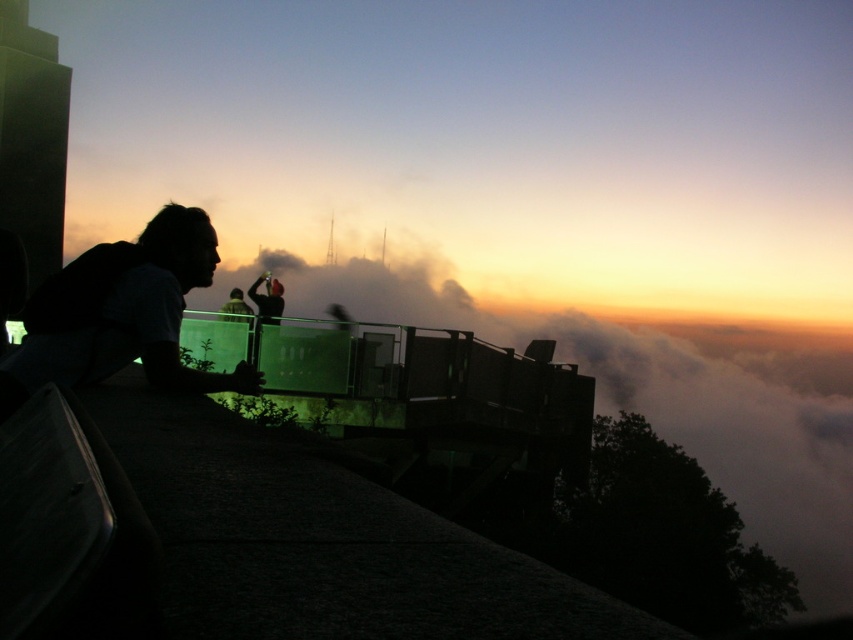
Question: Does dark hair at left have a greater width compared to dark fabric jacket at center?

Choices:
 (A) no
 (B) yes

Answer: (A)

Question: Does dark hair at left appear under dark fabric jacket at center?

Choices:
 (A) no
 (B) yes

Answer: (B)

Question: Which object appears closest to the camera in this image?

Choices:
 (A) dark hair at left
 (B) dark fabric jacket at center

Answer: (A)

Question: Which of the following is the farthest from the observer?

Choices:
 (A) pos(201,248)
 (B) pos(268,276)

Answer: (B)

Question: Can you confirm if dark hair at left is thinner than dark fabric jacket at center?

Choices:
 (A) no
 (B) yes

Answer: (B)

Question: Among these points, which one is farthest from the camera?

Choices:
 (A) click(134, 342)
 (B) click(265, 282)

Answer: (B)